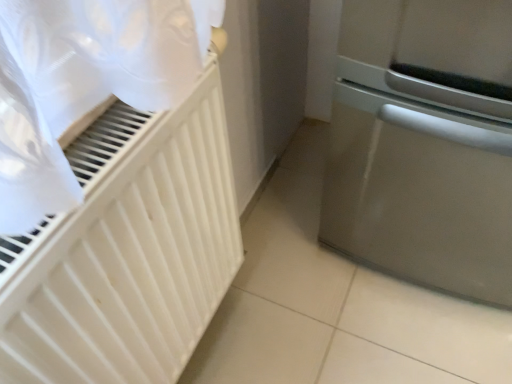
Question: Is satin silver dishwasher at right aimed at white matte radiator at left?

Choices:
 (A) no
 (B) yes

Answer: (A)

Question: Is white matte radiator at left at the back of satin silver dishwasher at right?

Choices:
 (A) yes
 (B) no

Answer: (B)

Question: From the image's perspective, would you say satin silver dishwasher at right is shown under white matte radiator at left?

Choices:
 (A) yes
 (B) no

Answer: (B)

Question: Does satin silver dishwasher at right have a larger size compared to white matte radiator at left?

Choices:
 (A) no
 (B) yes

Answer: (B)

Question: Is satin silver dishwasher at right outside white matte radiator at left?

Choices:
 (A) no
 (B) yes

Answer: (B)

Question: Does satin silver dishwasher at right appear on the right side of white matte radiator at left?

Choices:
 (A) yes
 (B) no

Answer: (A)

Question: Considering the relative sizes of white matte radiator at left and satin silver dishwasher at right in the image provided, is white matte radiator at left thinner than satin silver dishwasher at right?

Choices:
 (A) yes
 (B) no

Answer: (A)

Question: Can you confirm if white matte radiator at left is bigger than satin silver dishwasher at right?

Choices:
 (A) yes
 (B) no

Answer: (B)

Question: Is white matte radiator at left wider than satin silver dishwasher at right?

Choices:
 (A) yes
 (B) no

Answer: (B)

Question: Considering the relative positions of white matte radiator at left and satin silver dishwasher at right in the image provided, is white matte radiator at left to the right of satin silver dishwasher at right from the viewer's perspective?

Choices:
 (A) no
 (B) yes

Answer: (A)

Question: Considering the relative sizes of white matte radiator at left and satin silver dishwasher at right in the image provided, is white matte radiator at left taller than satin silver dishwasher at right?

Choices:
 (A) no
 (B) yes

Answer: (A)

Question: Can you confirm if white matte radiator at left is shorter than satin silver dishwasher at right?

Choices:
 (A) no
 (B) yes

Answer: (B)

Question: From a real-world perspective, is white matte radiator at left physically located above or below satin silver dishwasher at right?

Choices:
 (A) below
 (B) above

Answer: (B)